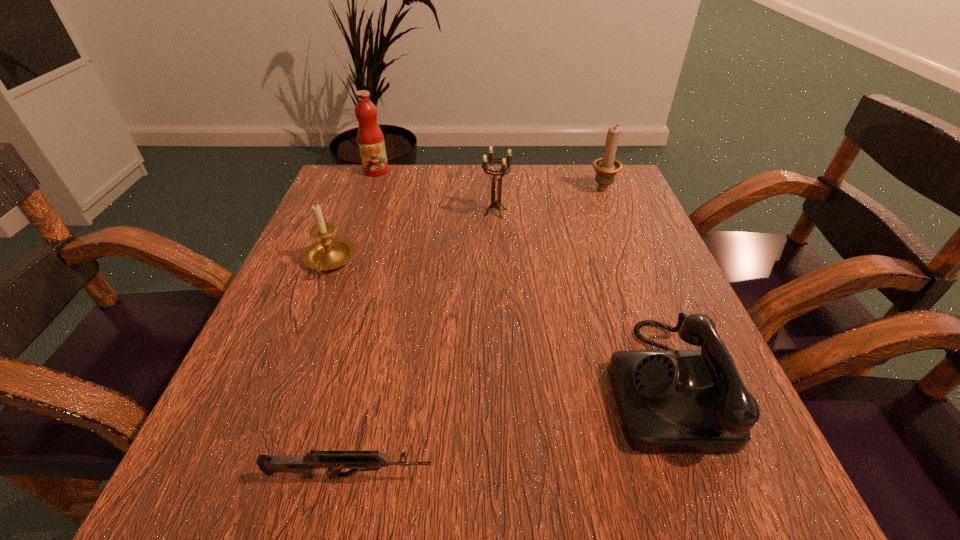
Where is `the nearest object`? the nearest object is located at coordinates (356, 460).

Find the location of a particular element. The width and height of the screenshot is (960, 540). vacant space located on the front label of the tallest object is located at coordinates (359, 219).

Find the location of a particular element. The width and height of the screenshot is (960, 540). vacant area situated 0.290m on the left of the second farthest candle holder is located at coordinates (355, 212).

Identify the location of vacant space located 0.390m with a handle on the side of the fourth farthest object. Image resolution: width=960 pixels, height=540 pixels. (239, 492).

Where is `vacant area situated on the dial of the telephone`? vacant area situated on the dial of the telephone is located at coordinates (539, 383).

The width and height of the screenshot is (960, 540). Identify the location of vacant space located 0.080m on the dial of the telephone. (558, 383).

Identify the location of free space located on the dial of the telephone. The image size is (960, 540). pyautogui.click(x=480, y=383).

This screenshot has height=540, width=960. What are the coordinates of `vacant space located 0.190m aimed along the barrel of the shortest object` in the screenshot? It's located at (579, 476).

This screenshot has height=540, width=960. Find the location of `fruit juice present at the far edge`. fruit juice present at the far edge is located at coordinates (370, 138).

Locate an element on the screen. Image resolution: width=960 pixels, height=540 pixels. telephone present at the near edge is located at coordinates (669, 401).